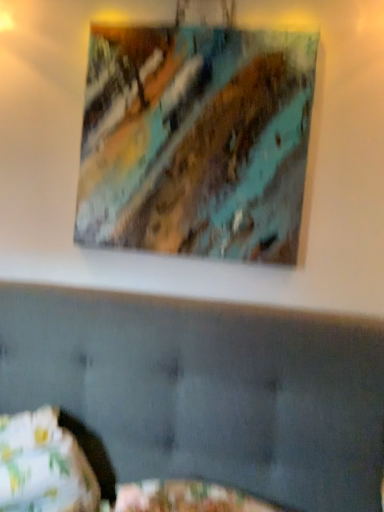
Image resolution: width=384 pixels, height=512 pixels. What do you see at coordinates (43, 466) in the screenshot?
I see `fluffy fabric pillow at lower left` at bounding box center [43, 466].

Identify the location of fluffy fabric pillow at lower left. The width and height of the screenshot is (384, 512). (43, 466).

This screenshot has height=512, width=384. What do you see at coordinates (196, 140) in the screenshot?
I see `matte acrylic painting at upper center` at bounding box center [196, 140].

Where is `matte acrylic painting at upper center`? This screenshot has height=512, width=384. matte acrylic painting at upper center is located at coordinates (196, 140).

At what (x,y) coordinates should I click in order to perform the action: click on fluffy fabric pillow at lower left. Please return your answer as a coordinate pair (x, y). Looking at the image, I should click on (43, 466).

Looking at this image, can you confirm if fluffy fabric pillow at lower left is positioned to the right of matte acrylic painting at upper center?

In fact, fluffy fabric pillow at lower left is to the left of matte acrylic painting at upper center.

Is fluffy fabric pillow at lower left in front of matte acrylic painting at upper center?

Yes, fluffy fabric pillow at lower left is in front of matte acrylic painting at upper center.

Is point (65, 502) closer or farther from the camera than point (124, 214)?

Point (65, 502) appears to be closer to the viewer than point (124, 214).

From the image's perspective, between fluffy fabric pillow at lower left and matte acrylic painting at upper center, which one is located above?

matte acrylic painting at upper center.

From a real-world perspective, who is located higher, fluffy fabric pillow at lower left or matte acrylic painting at upper center?

In real-world perspective, matte acrylic painting at upper center is above.

Does fluffy fabric pillow at lower left have a lesser width compared to matte acrylic painting at upper center?

No.

Can you confirm if fluffy fabric pillow at lower left is taller than matte acrylic painting at upper center?

In fact, fluffy fabric pillow at lower left may be shorter than matte acrylic painting at upper center.

Looking at the image, does fluffy fabric pillow at lower left seem bigger or smaller compared to matte acrylic painting at upper center?

In the image, fluffy fabric pillow at lower left appears to be larger than matte acrylic painting at upper center.

Would you say fluffy fabric pillow at lower left is inside or outside matte acrylic painting at upper center?

fluffy fabric pillow at lower left lies outside matte acrylic painting at upper center.

In the scene shown: Is the surface of fluffy fabric pillow at lower left in direct contact with matte acrylic painting at upper center?

No.

Is fluffy fabric pillow at lower left turned away from matte acrylic painting at upper center?

No.

How different are the orientations of fluffy fabric pillow at lower left and matte acrylic painting at upper center in degrees?

The angular difference between fluffy fabric pillow at lower left and matte acrylic painting at upper center is 3.36 degrees.

How much distance is there between fluffy fabric pillow at lower left and matte acrylic painting at upper center?

The distance of fluffy fabric pillow at lower left from matte acrylic painting at upper center is 36.06 inches.

At what (x,y) coordinates should I click in order to perform the action: click on pillow that is below the matte acrylic painting at upper center (from the image's perspective). Please return your answer as a coordinate pair (x, y). This screenshot has height=512, width=384. Looking at the image, I should click on (43, 466).

Looking at this image, which object is positioned more to the right, matte acrylic painting at upper center or fluffy fabric pillow at lower left?

matte acrylic painting at upper center is more to the right.

In the image, is matte acrylic painting at upper center positioned in front of or behind fluffy fabric pillow at lower left?

Clearly, matte acrylic painting at upper center is behind fluffy fabric pillow at lower left.

Which is behind, point (166, 65) or point (28, 447)?

The point (166, 65) is farther from the camera.

From the image's perspective, would you say matte acrylic painting at upper center is positioned over fluffy fabric pillow at lower left?

Indeed, from the image's perspective, matte acrylic painting at upper center is shown above fluffy fabric pillow at lower left.

Based on the photo, from a real-world perspective, is matte acrylic painting at upper center beneath fluffy fabric pillow at lower left?

Actually, matte acrylic painting at upper center is physically above fluffy fabric pillow at lower left in the real world.

Considering the sizes of matte acrylic painting at upper center and fluffy fabric pillow at lower left in the image, is matte acrylic painting at upper center wider or thinner than fluffy fabric pillow at lower left?

matte acrylic painting at upper center is thinner than fluffy fabric pillow at lower left.

Is matte acrylic painting at upper center taller than fluffy fabric pillow at lower left?

Indeed, matte acrylic painting at upper center has a greater height compared to fluffy fabric pillow at lower left.

Does matte acrylic painting at upper center have a larger size compared to fluffy fabric pillow at lower left?

No.

Is matte acrylic painting at upper center located outside fluffy fabric pillow at lower left?

matte acrylic painting at upper center is positioned outside fluffy fabric pillow at lower left.

Is there a large distance between matte acrylic painting at upper center and fluffy fabric pillow at lower left?

No.

Is matte acrylic painting at upper center facing away from fluffy fabric pillow at lower left?

No, fluffy fabric pillow at lower left is not at the back of matte acrylic painting at upper center.

Find the location of a particular element. The width and height of the screenshot is (384, 512). picture frame that is above the fluffy fabric pillow at lower left (from a real-world perspective) is located at coordinates (196, 140).

At what (x,y) coordinates should I click in order to perform the action: click on pillow below the matte acrylic painting at upper center (from the image's perspective). Please return your answer as a coordinate pair (x, y). Looking at the image, I should click on tap(43, 466).

The height and width of the screenshot is (512, 384). In order to click on picture frame lying above the fluffy fabric pillow at lower left (from the image's perspective) in this screenshot , I will do `click(196, 140)`.